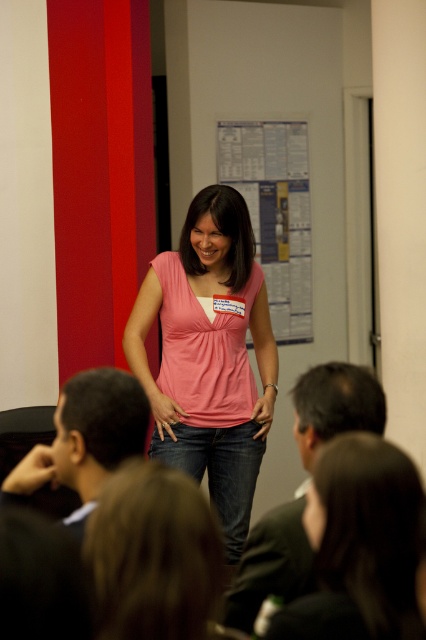
Measure the distance between pink matte tank top at center and white paperboard at center.

A distance of 5.06 feet exists between pink matte tank top at center and white paperboard at center.

Is pink matte tank top at center further to camera compared to white paperboard at center?

No, pink matte tank top at center is closer to the viewer.

The image size is (426, 640). What do you see at coordinates (209, 355) in the screenshot?
I see `pink matte tank top at center` at bounding box center [209, 355].

The image size is (426, 640). Identify the location of pink matte tank top at center. (209, 355).

Does pink matte shirt at center appear on the right side of white paperboard at center?

In fact, pink matte shirt at center is to the left of white paperboard at center.

Is point (354, 532) positioned in front of point (305, 205)?

Yes, it is in front of point (305, 205).

What do you see at coordinates (359, 545) in the screenshot? I see `pink matte shirt at center` at bounding box center [359, 545].

Find the location of a particular element. pink matte shirt at center is located at coordinates (359, 545).

Does pink matte tank top at center appear under pink matte shirt at center?

Incorrect, pink matte tank top at center is not positioned below pink matte shirt at center.

Does pink matte tank top at center have a greater width compared to pink matte shirt at center?

Correct, the width of pink matte tank top at center exceeds that of pink matte shirt at center.

Find the location of a particular element. The image size is (426, 640). pink matte tank top at center is located at coordinates (209, 355).